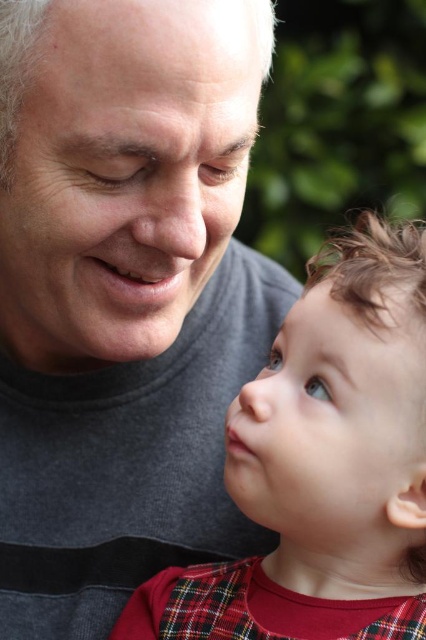
Based on the scene description, which object is wider, the smooth skin baby at center or the smooth white forehead at upper center?

The smooth skin baby at center is wider than the smooth white forehead at upper center according to the description.

You are a photographer trying to capture a closeup shot of both the matte gray face at upper left and the smooth skin baby at center. Given that the camera can only focus on one subject at a time, which subject should you choose to ensure the larger one is in focus?

The matte gray face at upper left is larger than the smooth skin baby at center, so you should focus on the matte gray face at upper left to ensure the larger subject is in focus.

You are a photographer trying to capture the interaction between the smooth skin baby at center and the smooth white forehead at upper center. Which of these two is located lower in the frame?

The smooth skin baby at center is positioned under the smooth white forehead at upper center, so the smooth skin baby at center is lower in the frame.